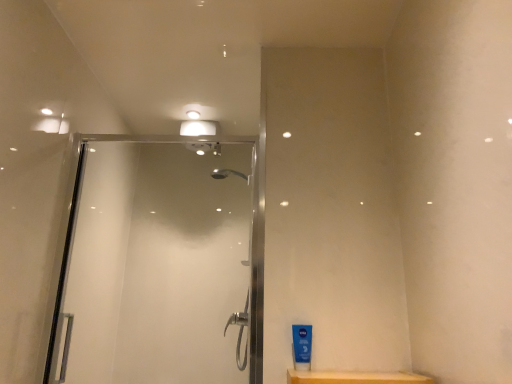
Question: Considering the positions of blue plastic tube at lower right and clear glass shower door at center in the image, is blue plastic tube at lower right wider or thinner than clear glass shower door at center?

Choices:
 (A) thin
 (B) wide

Answer: (A)

Question: From a real-world perspective, is blue plastic tube at lower right physically located above or below clear glass shower door at center?

Choices:
 (A) below
 (B) above

Answer: (A)

Question: Based on their sizes in the image, would you say blue plastic tube at lower right is bigger or smaller than clear glass shower door at center?

Choices:
 (A) big
 (B) small

Answer: (B)

Question: Considering the positions of clear glass shower door at center and blue plastic tube at lower right in the image, is clear glass shower door at center taller or shorter than blue plastic tube at lower right?

Choices:
 (A) short
 (B) tall

Answer: (B)

Question: Visually, is clear glass shower door at center positioned to the left or to the right of blue plastic tube at lower right?

Choices:
 (A) right
 (B) left

Answer: (B)

Question: From the image's perspective, is clear glass shower door at center above or below blue plastic tube at lower right?

Choices:
 (A) above
 (B) below

Answer: (A)

Question: In terms of size, does clear glass shower door at center appear bigger or smaller than blue plastic tube at lower right?

Choices:
 (A) small
 (B) big

Answer: (B)